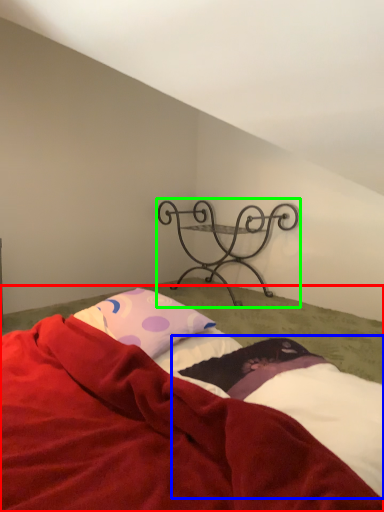
Question: Which object is the closest to the bed (highlighted by a red box)? Choose among these: sheet (highlighted by a blue box) or furniture (highlighted by a green box).

Choices:
 (A) sheet
 (B) furniture

Answer: (A)